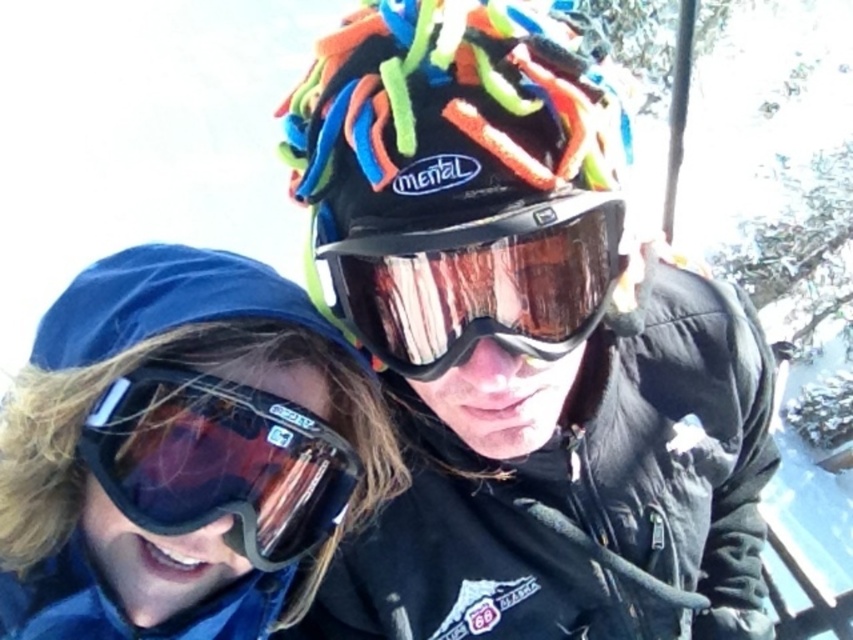
You are a photographer trying to capture a closeup of the multicolored knit beanie at center and the transparent plastic goggles at lower left. Given that the camera can only focus on one object at a time, which object should you focus on to ensure it appears larger in the photo?

The multicolored knit beanie at center is much taller than the transparent plastic goggles at lower left, so focusing on the multicolored knit beanie at center will make it appear larger in the photo.

In the scene shown: You are trying to decide which item to pack first for your winter trip. If you have a small backpack compartment that can only fit items smaller than the multicolored knit beanie at center, will the transparent plastic goggles at lower left fit in it?

The transparent plastic goggles at lower left are smaller than the multicolored knit beanie at center, so they will fit in the backpack compartment.